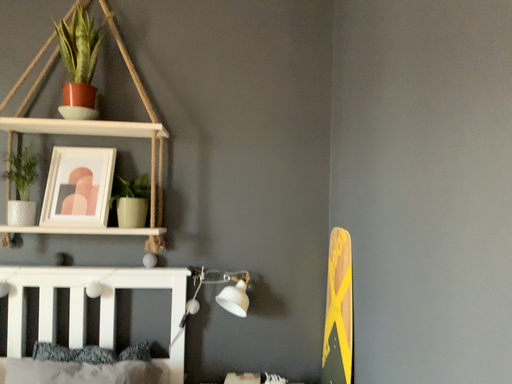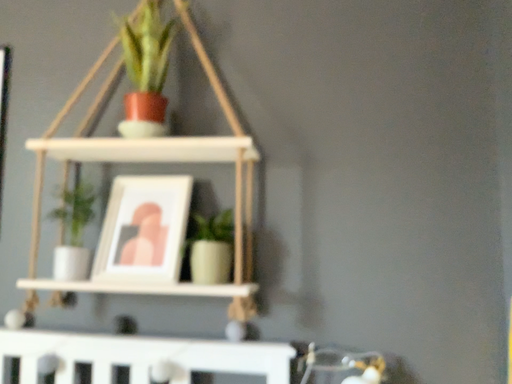
Question: How did the camera likely rotate when shooting the video?

Choices:
 (A) rotated left
 (B) rotated right

Answer: (A)